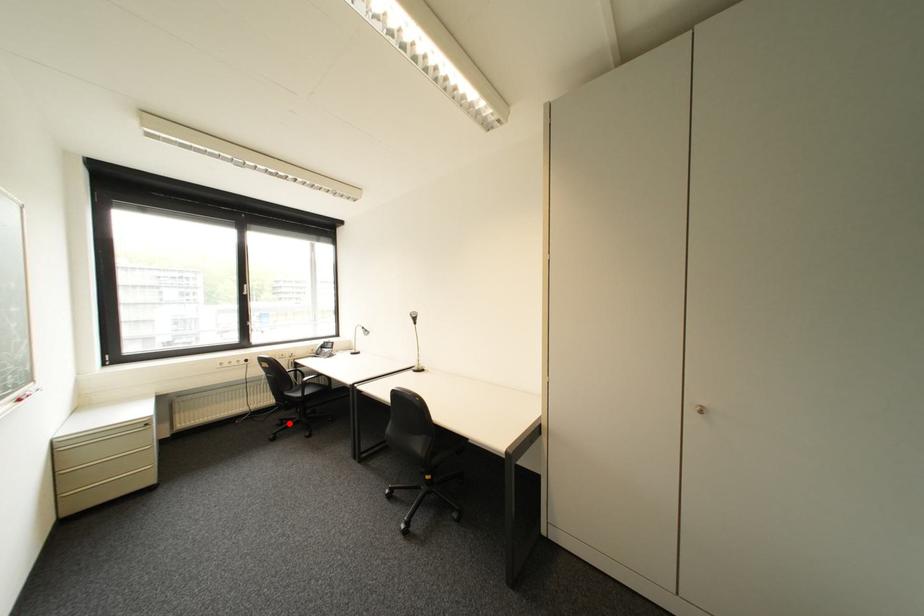
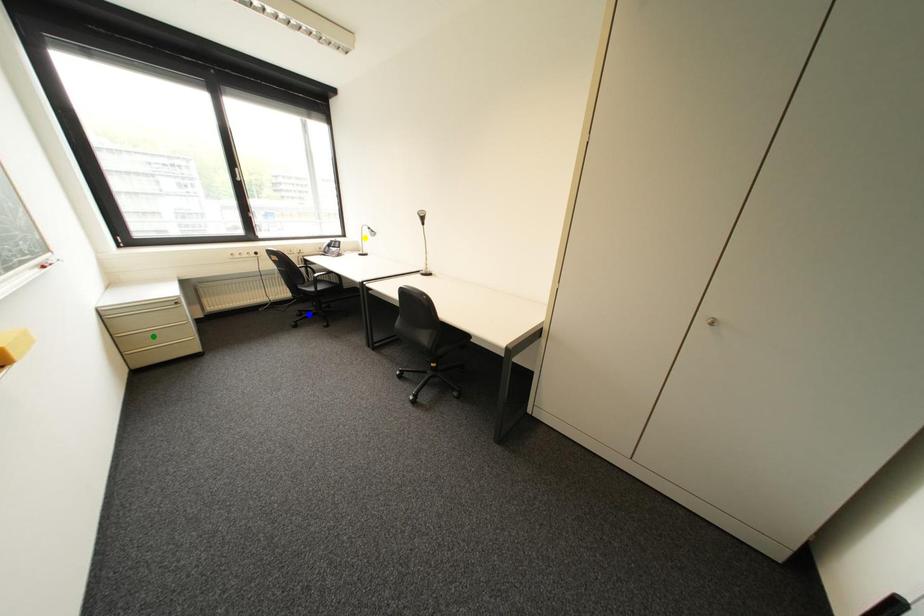
Question: I am providing you with two images of the same scene from different viewpoints. A red point is marked on the first image. You are given multiple points on the second image. Can you choose the point in image 2 that corresponds to the point in image 1?

Choices:
 (A) green point
 (B) blue point
 (C) yellow point

Answer: (B)